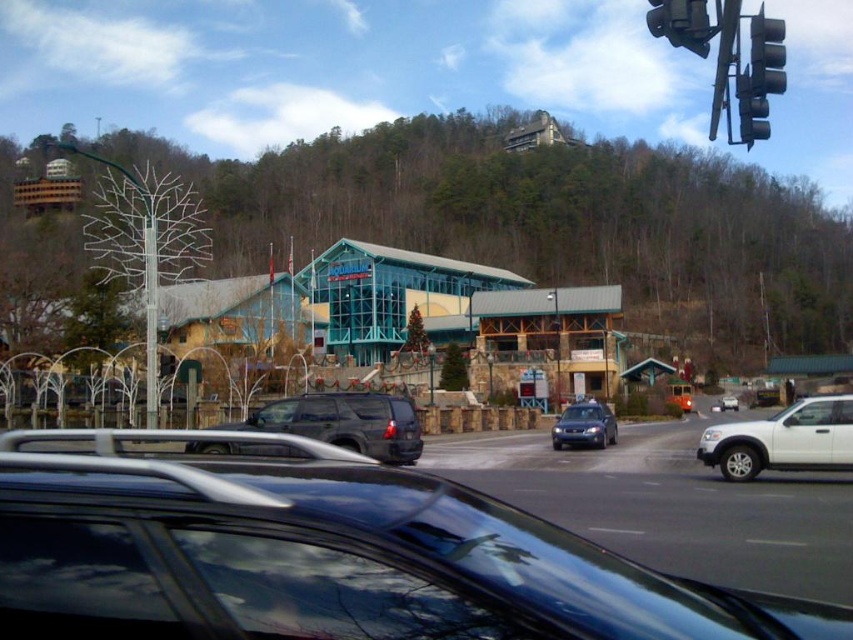
Question: Is black matte suv at center to the left of white matte suv at right from the viewer's perspective?

Choices:
 (A) no
 (B) yes

Answer: (B)

Question: Can you confirm if white matte suv at right is wider than metallic black traffic light at upper right?

Choices:
 (A) no
 (B) yes

Answer: (A)

Question: Which of the following is the farthest from the observer?

Choices:
 (A) metallic black traffic light at upper right
 (B) metallic blue sedan at center
 (C) white matte suv at center
 (D) matte black suv at center

Answer: (C)

Question: Estimate the real-world distances between objects in this image. Which object is closer to the white matte suv at right?

Choices:
 (A) black matte suv at center
 (B) white matte suv at center
 (C) metallic blue sedan at center

Answer: (C)

Question: Considering the relative positions of matte black suv at center and white matte suv at center in the image provided, where is matte black suv at center located with respect to white matte suv at center?

Choices:
 (A) above
 (B) below

Answer: (A)

Question: Which object appears closest to the camera in this image?

Choices:
 (A) black matte suv at center
 (B) matte black suv at center
 (C) white matte suv at center

Answer: (A)